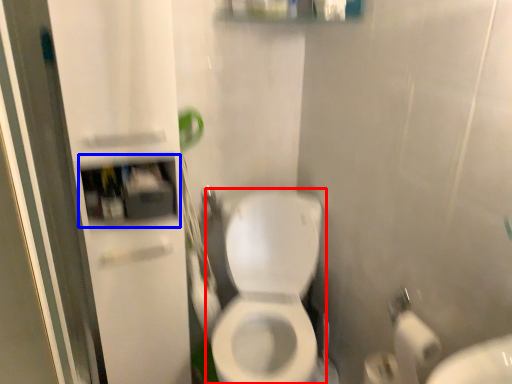
Question: Which point is closer to the camera, toilet (highlighted by a red box) or medicine cabinet (highlighted by a blue box)?

Choices:
 (A) toilet
 (B) medicine cabinet

Answer: (A)